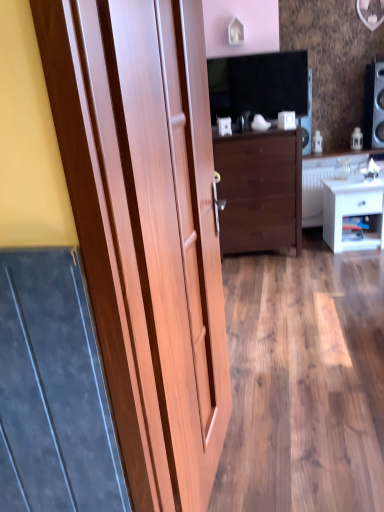
Question: Is white glossy nightstand at lower right a part of wooden door at left?

Choices:
 (A) no
 (B) yes

Answer: (A)

Question: Does wooden door at left have a lesser height compared to white glossy nightstand at lower right?

Choices:
 (A) yes
 (B) no

Answer: (B)

Question: From the image's perspective, would you say wooden door at left is positioned over white glossy nightstand at lower right?

Choices:
 (A) no
 (B) yes

Answer: (A)

Question: From a real-world perspective, is wooden door at left beneath white glossy nightstand at lower right?

Choices:
 (A) no
 (B) yes

Answer: (A)

Question: Does wooden door at left lie in front of white glossy nightstand at lower right?

Choices:
 (A) no
 (B) yes

Answer: (B)

Question: Looking at their shapes, would you say dark wood chest of drawers at center is wider or thinner than matte black tv at upper center?

Choices:
 (A) wide
 (B) thin

Answer: (A)

Question: Considering the positions of point (230, 228) and point (263, 101), is point (230, 228) closer or farther from the camera than point (263, 101)?

Choices:
 (A) closer
 (B) farther

Answer: (B)

Question: From a real-world perspective, is dark wood chest of drawers at center physically located above or below matte black tv at upper center?

Choices:
 (A) above
 (B) below

Answer: (B)

Question: Considering the relative positions of dark wood chest of drawers at center and matte black tv at upper center in the image provided, is dark wood chest of drawers at center to the left or to the right of matte black tv at upper center?

Choices:
 (A) right
 (B) left

Answer: (A)

Question: Is white glossy counter top at center inside or outside of white glossy nightstand at lower right?

Choices:
 (A) outside
 (B) inside

Answer: (A)

Question: Is point (365, 159) closer or farther from the camera than point (327, 240)?

Choices:
 (A) closer
 (B) farther

Answer: (B)

Question: Is white glossy counter top at center in front of or behind white glossy nightstand at lower right in the image?

Choices:
 (A) behind
 (B) front

Answer: (A)

Question: Looking at their shapes, would you say white glossy counter top at center is wider or thinner than white glossy nightstand at lower right?

Choices:
 (A) wide
 (B) thin

Answer: (A)

Question: Considering the positions of white glossy counter top at center and wooden door at left in the image, is white glossy counter top at center taller or shorter than wooden door at left?

Choices:
 (A) tall
 (B) short

Answer: (B)

Question: Considering the positions of white glossy counter top at center and wooden door at left in the image, is white glossy counter top at center wider or thinner than wooden door at left?

Choices:
 (A) wide
 (B) thin

Answer: (A)